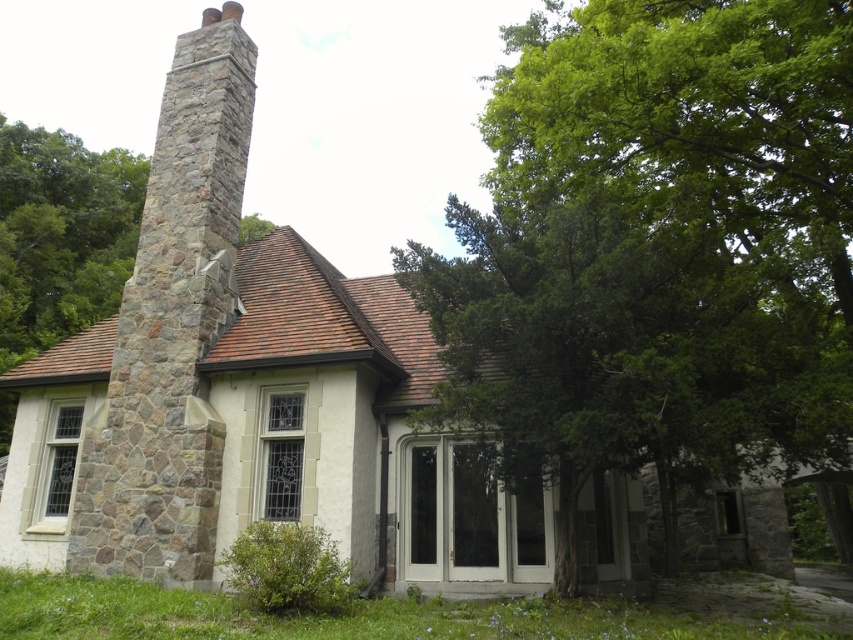
Question: Is green leafy tree at center bigger than stone chimney at left?

Choices:
 (A) no
 (B) yes

Answer: (B)

Question: In this image, where is green leafy tree at center located relative to stone chimney at left?

Choices:
 (A) above
 (B) below

Answer: (A)

Question: Which point appears closest to the camera in this image?

Choices:
 (A) (149, 234)
 (B) (695, 340)

Answer: (B)

Question: Which of the following is the farthest from the observer?

Choices:
 (A) (570, 38)
 (B) (199, 186)

Answer: (B)

Question: Does green leafy tree at center appear on the left side of stone chimney at left?

Choices:
 (A) yes
 (B) no

Answer: (B)